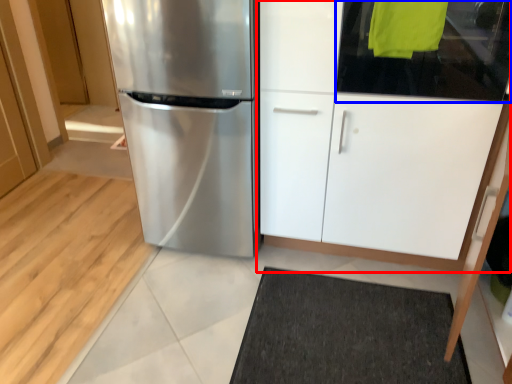
Question: Which object is further to the camera taking this photo, cabinetry (highlighted by a red box) or glass door (highlighted by a blue box)?

Choices:
 (A) cabinetry
 (B) glass door

Answer: (B)